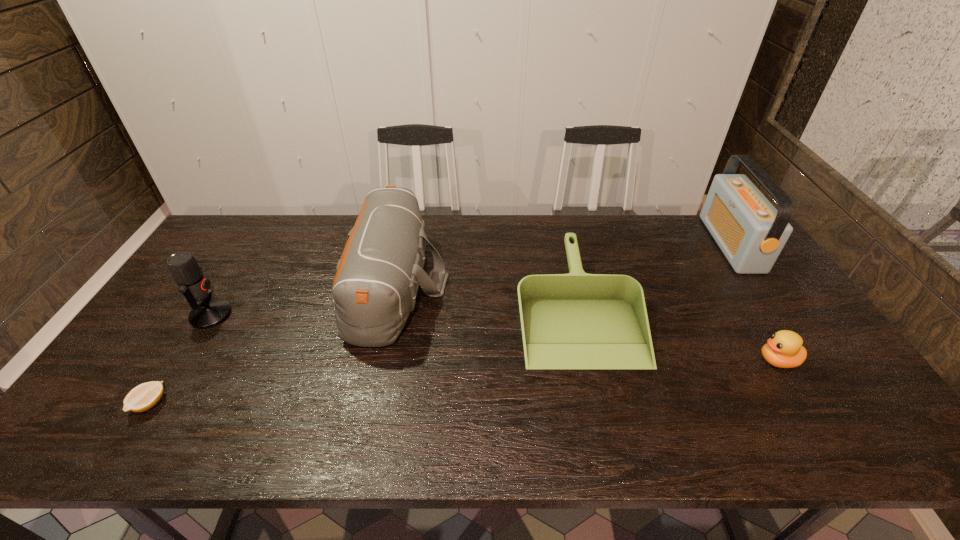
Select which object appears as the third closest to the duffel bag. Please provide its 2D coordinates. Your answer should be formatted as a tuple, i.e. [(x, y)], where the tuple contains the x and y coordinates of a point satisfying the conditions above.

[(144, 396)]

Locate an element on the screen. The width and height of the screenshot is (960, 540). vacant region that satisfies the following two spatial constraints: 1. on the front-facing side of the radio receiver; 2. on the scoop of the fourth object from left to right is located at coordinates (774, 306).

This screenshot has width=960, height=540. Find the location of `free location that satisfies the following two spatial constraints: 1. on the front-facing side of the radio receiver; 2. on the scoop of the dustpan`. free location that satisfies the following two spatial constraints: 1. on the front-facing side of the radio receiver; 2. on the scoop of the dustpan is located at coordinates (774, 306).

In order to click on vacant space that satisfies the following two spatial constraints: 1. on the front-facing side of the tallest object; 2. on the scoop of the third object from right to left in this screenshot , I will do `click(774, 306)`.